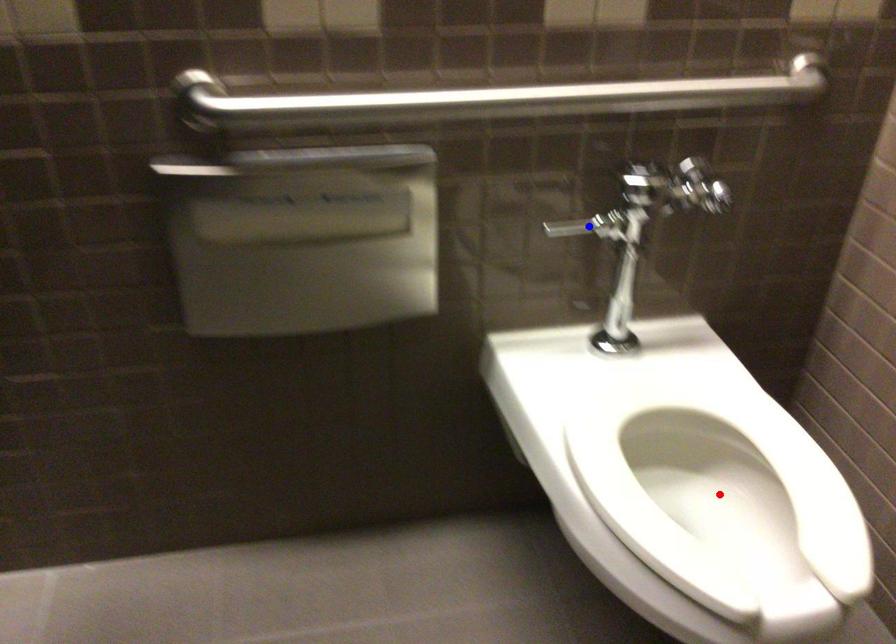
Question: Which of the two points in the image is closer to the camera?

Choices:
 (A) Blue point is closer.
 (B) Red point is closer.

Answer: (B)